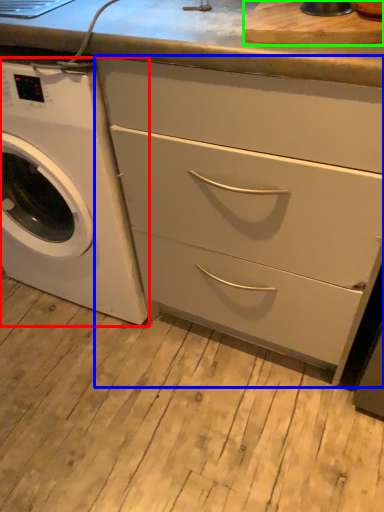
Question: Which object is the closest to the washing machine (highlighted by a red box)? Choose among these: chest of drawers (highlighted by a blue box) or cutting board (highlighted by a green box).

Choices:
 (A) chest of drawers
 (B) cutting board

Answer: (A)